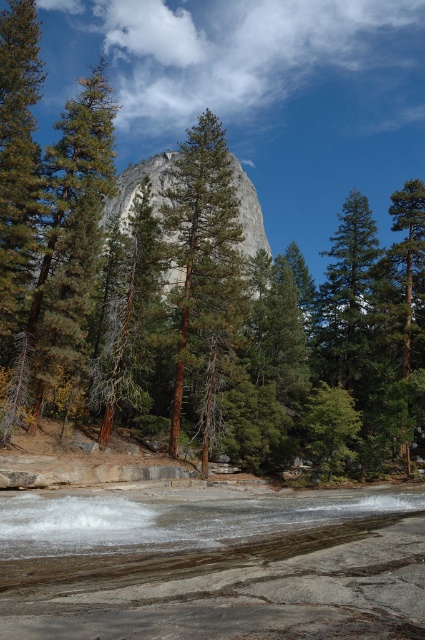
Question: Which object is positioned farthest from the green rough textured tree at center?

Choices:
 (A) green textured tree at center
 (B) gray granite mountain at center
 (C) clear water at lower center

Answer: (C)

Question: Is green rough textured tree at center in front of green textured tree at center?

Choices:
 (A) yes
 (B) no

Answer: (B)

Question: Can you confirm if green rough textured tree at center is wider than green textured tree at center?

Choices:
 (A) no
 (B) yes

Answer: (A)

Question: Which object appears farthest from the camera in this image?

Choices:
 (A) green textured tree at center
 (B) clear water at lower center
 (C) gray granite mountain at center
 (D) green rough textured tree at center

Answer: (C)

Question: Observing the image, what is the correct spatial positioning of green rough textured tree at center in reference to green matte tree at center?

Choices:
 (A) above
 (B) below

Answer: (A)

Question: Which object is the farthest from the green rough textured tree at center?

Choices:
 (A) green textured tree at center
 (B) clear water at lower center
 (C) gray granite mountain at center
 (D) green matte tree at center

Answer: (B)